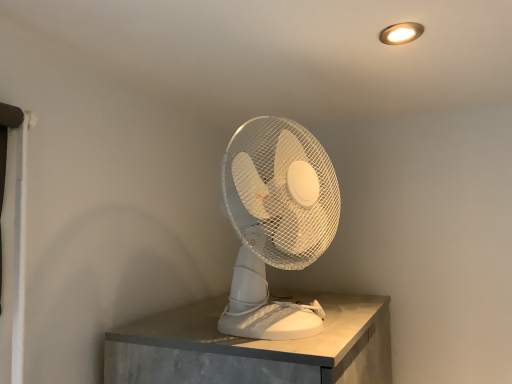
Where is `vacant area located to the right-hand side of matte gold light fixture at upper right`? This screenshot has width=512, height=384. vacant area located to the right-hand side of matte gold light fixture at upper right is located at coordinates (457, 37).